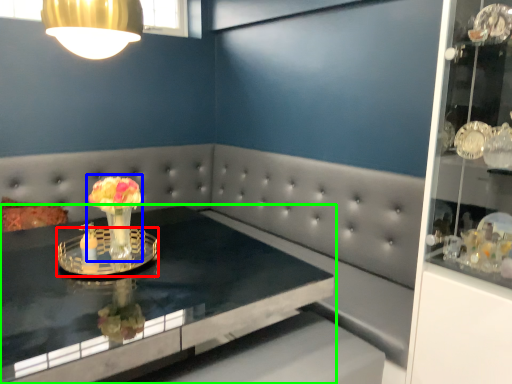
Question: Which object is positioned farthest from glass plate (highlighted by a red box)? Select from floral arrangement (highlighted by a blue box) and table (highlighted by a green box).

Choices:
 (A) floral arrangement
 (B) table

Answer: (B)